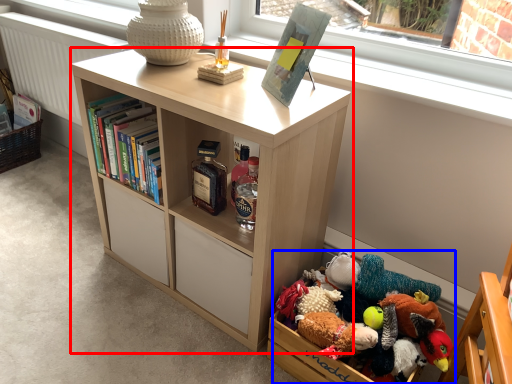
Question: Which object is further to the camera taking this photo, bookcase (highlighted by a red box) or toy (highlighted by a blue box)?

Choices:
 (A) bookcase
 (B) toy

Answer: (B)